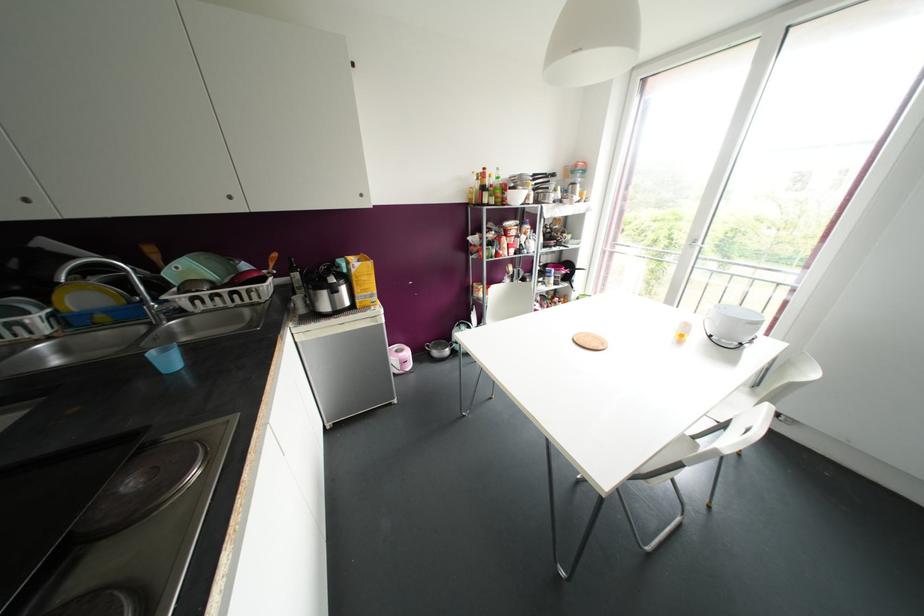
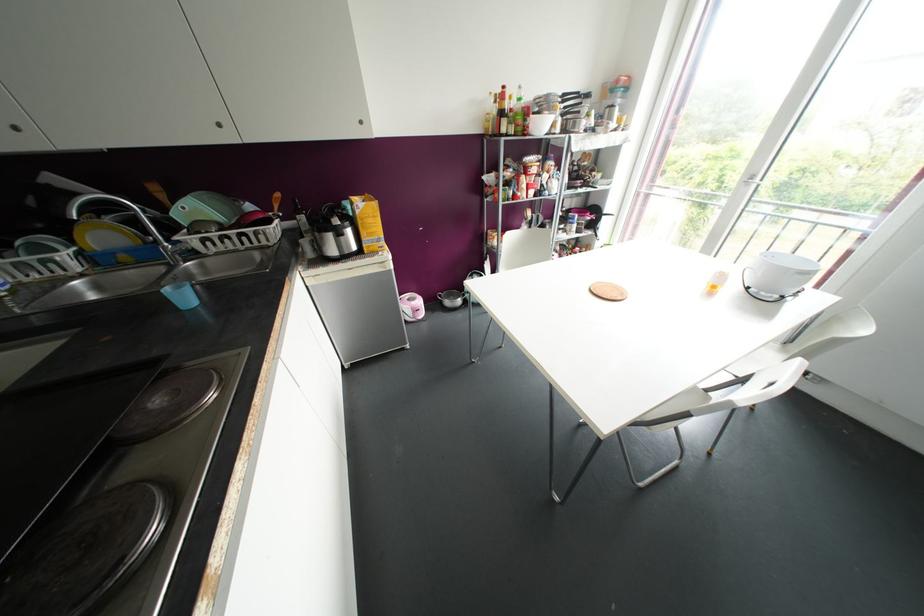
Find the pixel in the second image that matches [178,312] in the first image.

(192, 253)